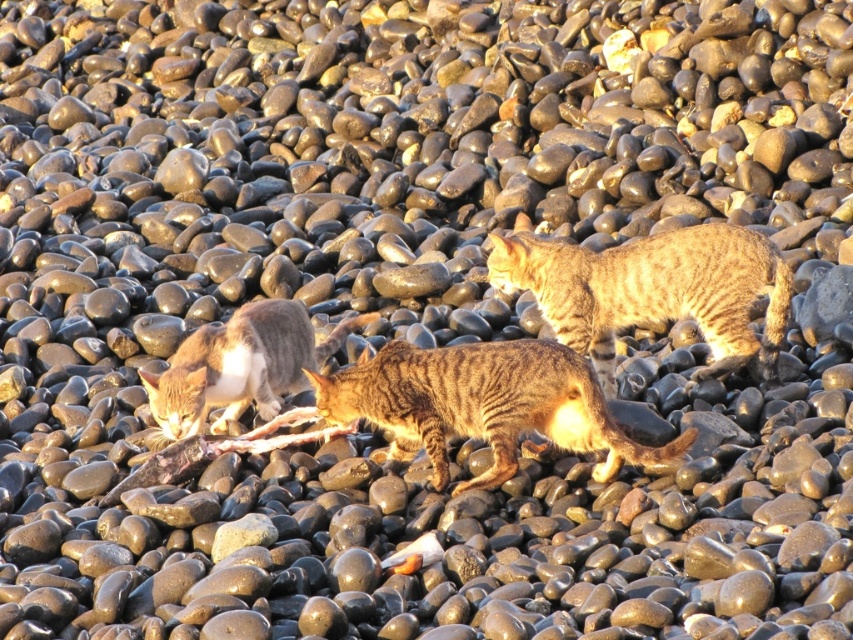
You are a photographer standing at the edge of the pebble beach. You want to take a photo of the tabby fur cat at center and the tabby fur cat at lower left. If your camera can focus on objects within a 1.5 meter range, will both cats be in focus?

The tabby fur cat at center is 1.04 meters away from the tabby fur cat at lower left. Since the distance between them is within the camera focus range of 1.5 meters, both cats will be in focus.

You are standing on the pebble beach and want to walk to the striped fur cat at center. Which direction should you move relative to your current position at point (x=485, y=404)?

The striped fur cat at center is located at point (x=485, y=404), so you are already at the same position as the striped fur cat at center.